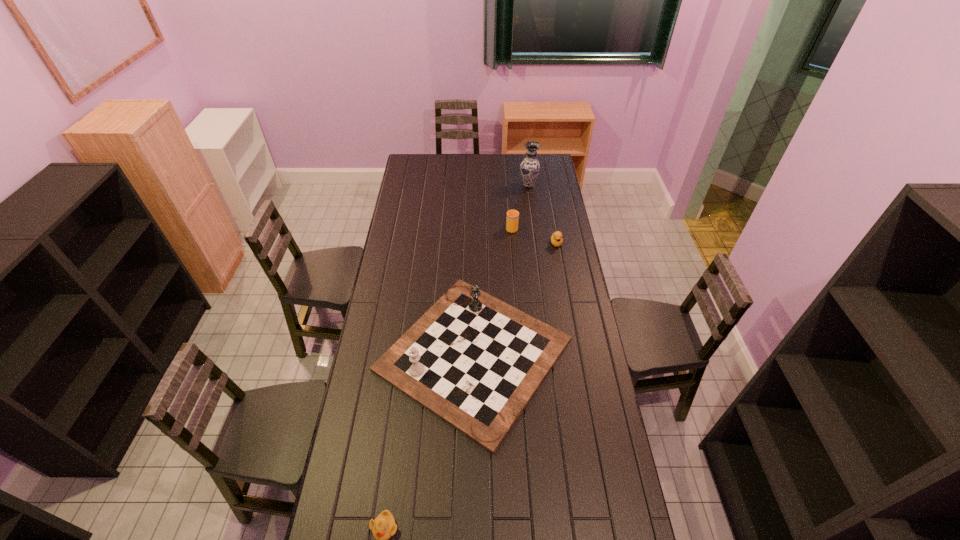
The width and height of the screenshot is (960, 540). In the image, there is a desktop. In order to click on vacant space at the right edge in this screenshot , I will do `click(567, 264)`.

What are the coordinates of `blank space at the far right corner of the desktop` in the screenshot? It's located at point(552,173).

Where is `unoccupied position between the farthest object and the second farthest object`? The width and height of the screenshot is (960, 540). unoccupied position between the farthest object and the second farthest object is located at coordinates (520, 206).

This screenshot has height=540, width=960. Identify the location of unoccupied position between the vase and the third tallest object. (520, 206).

Locate an element on the screen. vacant area between the second tallest object and the cup is located at coordinates (492, 291).

Identify the location of vacant space that is in between the tallest object and the fourth farthest object. Image resolution: width=960 pixels, height=540 pixels. (501, 270).

The height and width of the screenshot is (540, 960). I want to click on object that is the nearest to the second tallest object, so click(384, 526).

Locate which object ranks third in proximity to the fourth tallest object. Please provide its 2D coordinates. Your answer should be formatted as a tuple, i.e. [(x, y)], where the tuple contains the x and y coordinates of a point satisfying the conditions above.

[(530, 167)]